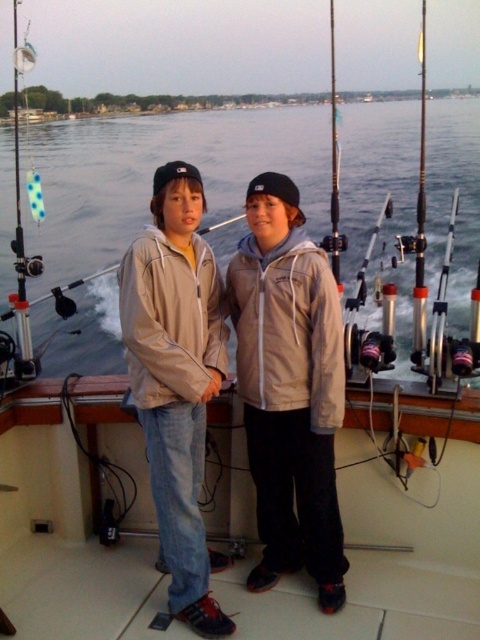
Which is behind, point (182, 561) or point (417, 216)?

The point (417, 216) is more distant.

Can you confirm if light beige jacket at center is positioned to the left of clear plastic fishing pole at upper right?

Correct, you'll find light beige jacket at center to the left of clear plastic fishing pole at upper right.

The width and height of the screenshot is (480, 640). In order to click on light beige jacket at center in this screenshot , I will do `click(178, 378)`.

Who is more forward, (240, 227) or (419, 236)?

Point (419, 236) is in front.

Who is taller, clear water at center or clear plastic fishing pole at upper right?

With more height is clear plastic fishing pole at upper right.

You are a GUI agent. You are given a task and a screenshot of the screen. Output one action in this format:
    pyautogui.click(x=<x>, y=<y>)
    Task: Click on the clear water at center
    The image size is (480, 640).
    Given the screenshot: What is the action you would take?
    pyautogui.click(x=153, y=172)

Where is `clear water at center`? clear water at center is located at coordinates (153, 172).

Does clear water at center have a lesser height compared to light beige jacket at center?

In fact, clear water at center may be taller than light beige jacket at center.

Who is shorter, clear water at center or light beige jacket at center?

light beige jacket at center is shorter.

Is point (375, 157) in front of point (308, 406)?

No, (375, 157) is further to viewer.

This screenshot has width=480, height=640. I want to click on clear water at center, so click(153, 172).